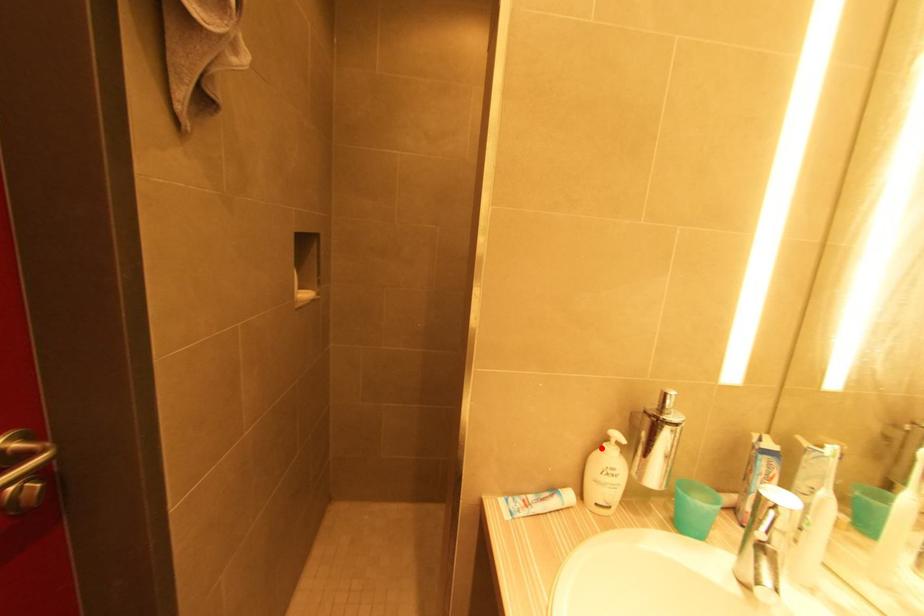
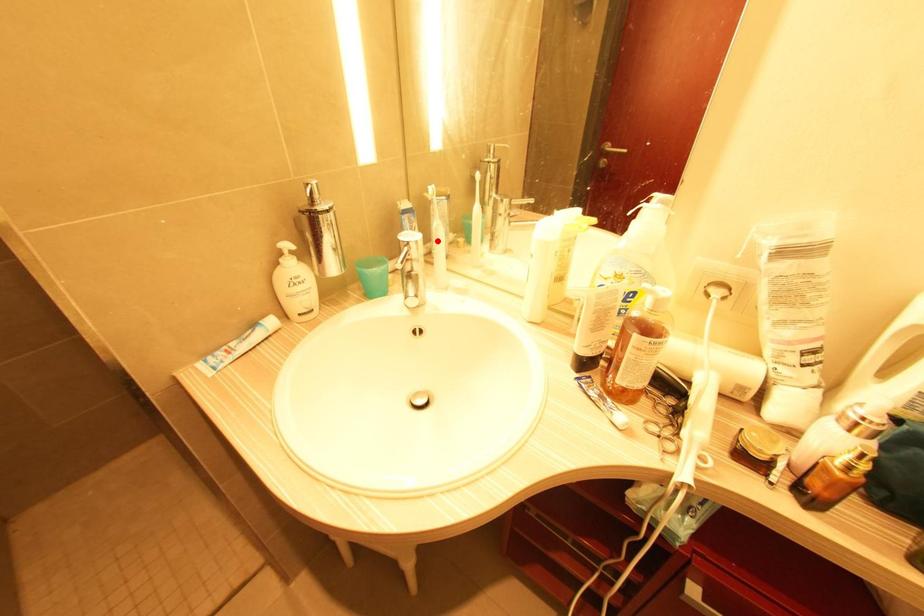
I am providing you with two images of the same scene from different viewpoints. A red point is marked on the first image and another point is marked on the second image. Are the points marked in image1 and image2 representing the same 3D position?

No